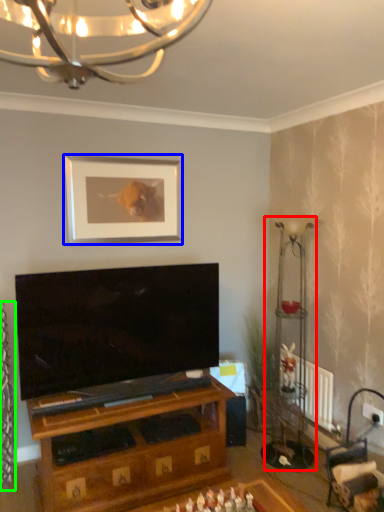
Question: Based on their relative distances, which object is farther from lamp (highlighted by a red box)? Choose from picture frame (highlighted by a blue box) and curtain (highlighted by a green box).

Choices:
 (A) picture frame
 (B) curtain

Answer: (B)